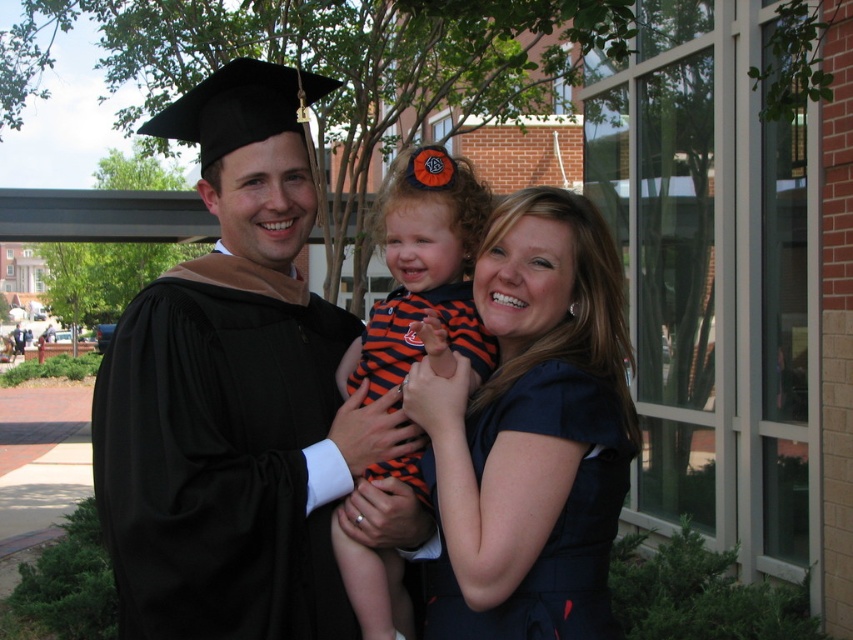
Can you confirm if matte black graduation gown at center is wider than striped fabric dress at center?

Yes, matte black graduation gown at center is wider than striped fabric dress at center.

Can you confirm if matte black graduation gown at center is positioned to the right of striped fabric dress at center?

Incorrect, matte black graduation gown at center is not on the right side of striped fabric dress at center.

Locate an element on the screen. matte black graduation gown at center is located at coordinates (233, 397).

Is matte black graduation gown at center behind navy blue dress at center?

That is True.

Which is below, matte black graduation gown at center or navy blue dress at center?

navy blue dress at center is lower down.

Between point (293, 198) and point (581, 493), which one is positioned behind?

Positioned behind is point (293, 198).

Where is `matte black graduation gown at center`? matte black graduation gown at center is located at coordinates (233, 397).

Does navy blue dress at center appear on the left side of striped fabric dress at center?

Incorrect, navy blue dress at center is not on the left side of striped fabric dress at center.

Does navy blue dress at center have a greater height compared to striped fabric dress at center?

Incorrect, navy blue dress at center's height is not larger of striped fabric dress at center's.

This screenshot has height=640, width=853. What do you see at coordinates (532, 433) in the screenshot? I see `navy blue dress at center` at bounding box center [532, 433].

You are a GUI agent. You are given a task and a screenshot of the screen. Output one action in this format:
    pyautogui.click(x=<x>, y=<y>)
    Task: Click on the navy blue dress at center
    Image resolution: width=853 pixels, height=640 pixels.
    Given the screenshot: What is the action you would take?
    pyautogui.click(x=532, y=433)